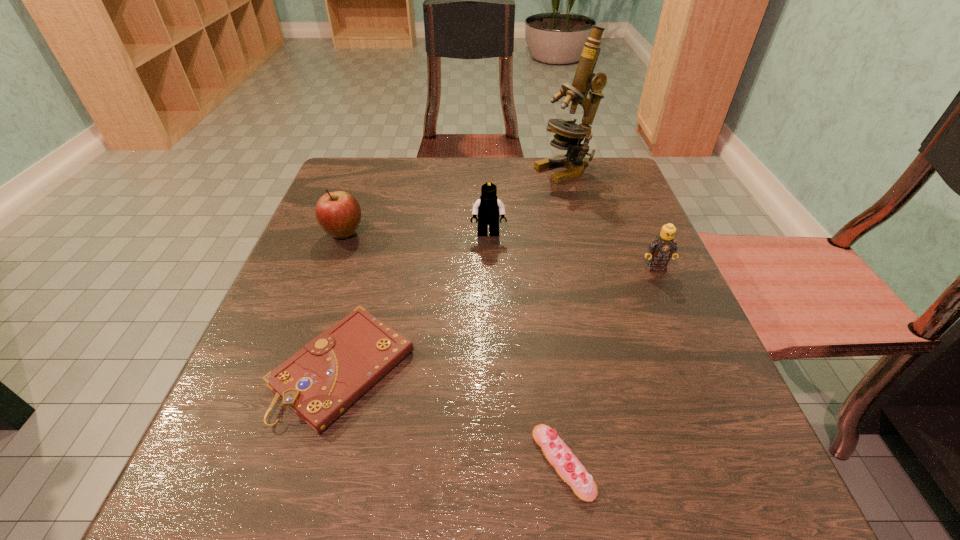
This screenshot has width=960, height=540. What are the coordinates of `vacant region located 0.130m on the front-facing side of the fourth object from right to left` in the screenshot? It's located at (490, 284).

You are a GUI agent. You are given a task and a screenshot of the screen. Output one action in this format:
    pyautogui.click(x=<x>, y=<y>)
    Task: Click on the vacant position located on the right of the apple
    This screenshot has width=960, height=540.
    Given the screenshot: What is the action you would take?
    pyautogui.click(x=545, y=234)

The height and width of the screenshot is (540, 960). Identify the location of vacant space located 0.400m in front of the rightmost object. (751, 486).

Where is `vacant region located on the back of the notebook`? vacant region located on the back of the notebook is located at coordinates (384, 218).

Image resolution: width=960 pixels, height=540 pixels. Identify the location of free space located 0.170m on the right of the eclair. 722,463.

Locate an element on the screen. This screenshot has width=960, height=540. object located at the far edge is located at coordinates (569, 135).

The width and height of the screenshot is (960, 540). I want to click on object that is at the near edge, so click(x=558, y=454).

Where is `apple situated at the left edge`? The image size is (960, 540). apple situated at the left edge is located at coordinates (338, 213).

Where is `notebook positioned at the left edge`? Image resolution: width=960 pixels, height=540 pixels. notebook positioned at the left edge is located at coordinates (321, 381).

Locate an element on the screen. microscope situated at the right edge is located at coordinates (569, 135).